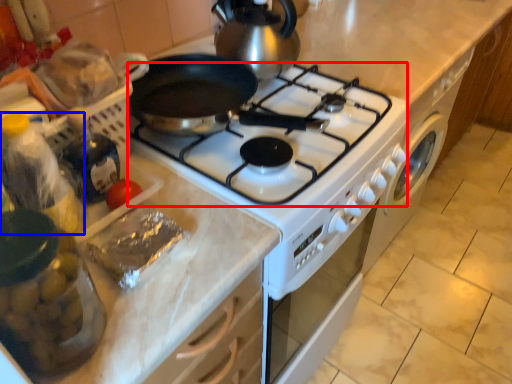
Question: Among these objects, which one is farthest to the camera, gas stove (highlighted by a red box) or bottle (highlighted by a blue box)?

Choices:
 (A) gas stove
 (B) bottle

Answer: (A)